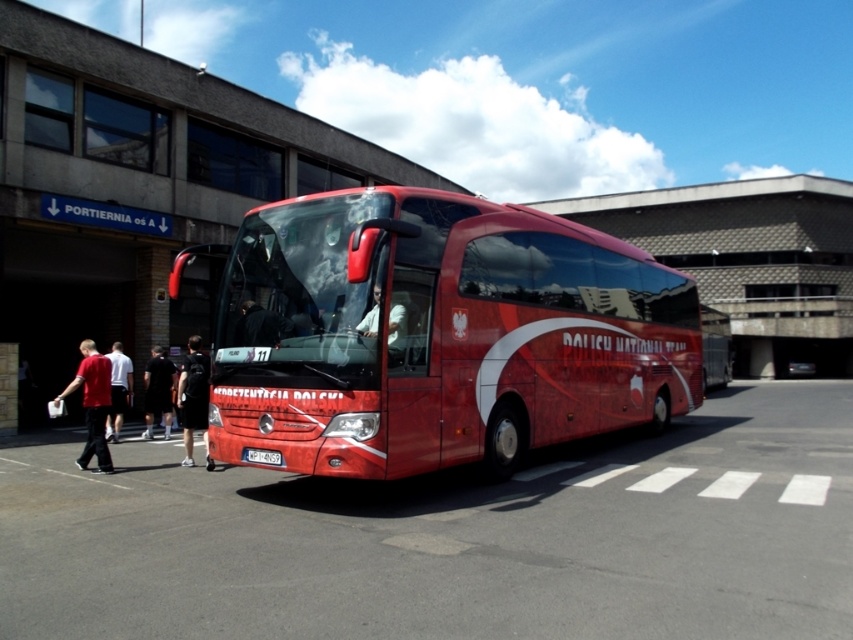
Question: Does black fabric shorts at lower left have a lesser width compared to white fabric shirt at center?

Choices:
 (A) no
 (B) yes

Answer: (A)

Question: Considering the real-world distances, which object is farthest from the white fabric shirt at center?

Choices:
 (A) black fabric shorts at lower left
 (B) shiny red bus at center
 (C) white cotton shirt at center
 (D) glossy red bus at center

Answer: (C)

Question: Where is matte red shirt at left located in relation to dark fabric jacket at center in the image?

Choices:
 (A) right
 (B) left

Answer: (B)

Question: Which is nearer to the glossy red bus at center?

Choices:
 (A) white fabric shirt at center
 (B) shiny red bus at center
 (C) dark fabric jacket at center
 (D) matte red shirt at left

Answer: (B)

Question: Which of the following is the farthest from the observer?

Choices:
 (A) (161, 381)
 (B) (393, 572)
 (C) (405, 337)

Answer: (A)

Question: Where is shiny red bus at center located in relation to matte red shirt at left in the image?

Choices:
 (A) left
 (B) right

Answer: (B)